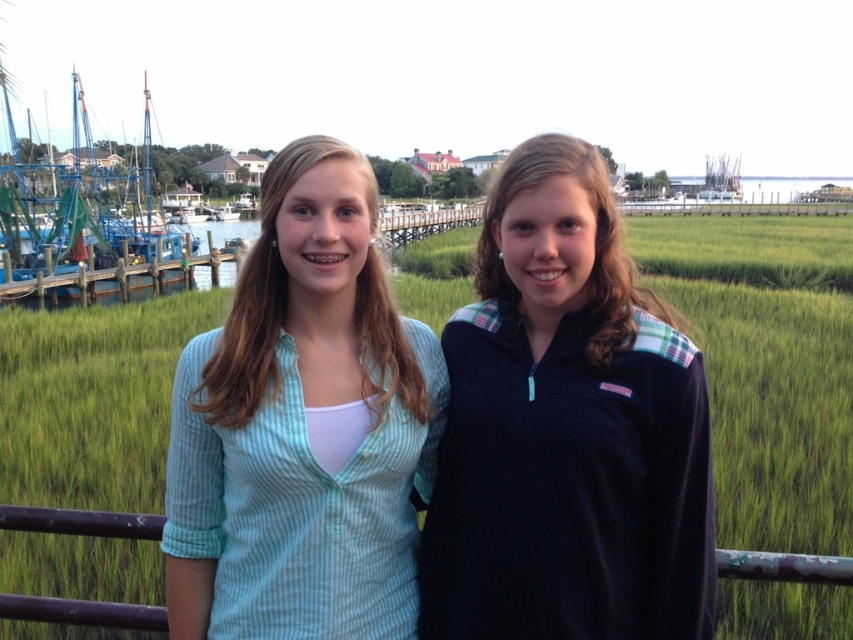
What color is the object located at the coordinates point (566, 432)?

The object at point (566, 432) is navy blue fleece.